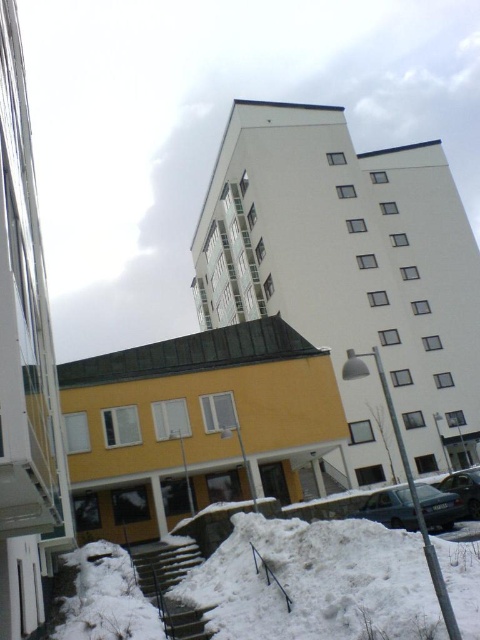
You are a delivery person standing next to the metallic silver car at center, and you need to deliver a package to the yellow matte building at left. The delivery robot you are using has a maximum range of 10 meters. Can the robot reach the building from your current position?

The yellow matte building at left and metallic silver car at center are 12.07 meters apart, so the robot cannot reach the building as it exceeds the maximum range of 10 meters.

You are standing in front of the building and want to take a photo of both the yellow matte building at left and the metallic silver car at center. Which object should you focus on first to ensure both are in frame?

Since the yellow matte building at left is closer to the viewer than the metallic silver car at center, you should focus on the metallic silver car at center first to ensure both are in frame.